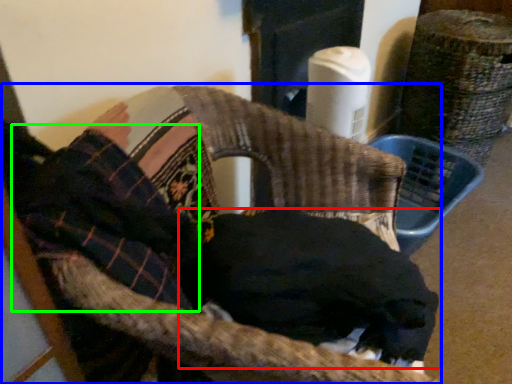
Question: Estimate the real-world distances between objects in this image. Which object is farther from dog (highlighted by a red box), chair (highlighted by a blue box) or clothing (highlighted by a green box)?

Choices:
 (A) chair
 (B) clothing

Answer: (B)